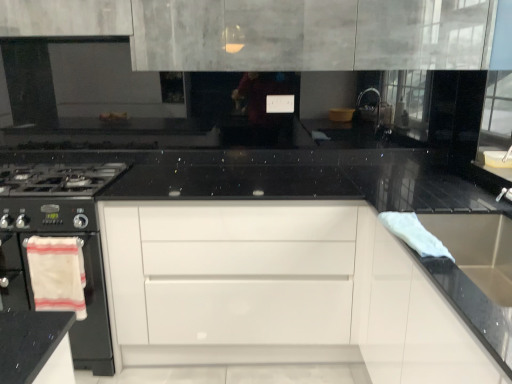
Question: Is white cloth at right, marked as the second material in a bottom-to-top arrangement, inside white glossy drawer at center?

Choices:
 (A) no
 (B) yes

Answer: (A)

Question: From a real-world perspective, is white glossy drawer at center physically above white cloth at right, marked as the second material in a bottom-to-top arrangement?

Choices:
 (A) yes
 (B) no

Answer: (B)

Question: Is white glossy drawer at center further to the viewer compared to white cloth at right, which is the second material from back to front?

Choices:
 (A) no
 (B) yes

Answer: (B)

Question: Can you confirm if white glossy drawer at center is shorter than white cloth at right, the 1th material viewed from the top?

Choices:
 (A) no
 (B) yes

Answer: (A)

Question: From the image's perspective, would you say white glossy drawer at center is shown under white cloth at right, the 1th material when ordered from front to back?

Choices:
 (A) yes
 (B) no

Answer: (A)

Question: Considering the relative sizes of white glossy drawer at center and white cloth at right, the 2th material when ordered from left to right, in the image provided, is white glossy drawer at center smaller than white cloth at right, the 2th material when ordered from left to right,?

Choices:
 (A) no
 (B) yes

Answer: (A)

Question: From the image's perspective, is white cotton towel at left, which is the second material in right-to-left order, beneath white cloth at right, the 1th material when ordered from front to back?

Choices:
 (A) no
 (B) yes

Answer: (B)

Question: Is white cotton towel at left, which is the second material in right-to-left order, aimed at white cloth at right, which is the second material from back to front?

Choices:
 (A) no
 (B) yes

Answer: (A)

Question: Considering the relative sizes of white cotton towel at left, acting as the first material starting from the back, and white cloth at right, which is the second material from back to front, in the image provided, is white cotton towel at left, acting as the first material starting from the back, thinner than white cloth at right, which is the second material from back to front,?

Choices:
 (A) no
 (B) yes

Answer: (B)

Question: Is white cotton towel at left, which is the second material in right-to-left order, not inside white cloth at right, the 1th material from the right?

Choices:
 (A) no
 (B) yes

Answer: (B)

Question: Is white cotton towel at left, acting as the first material starting from the back, closer to camera compared to white cloth at right, marked as the second material in a bottom-to-top arrangement?

Choices:
 (A) no
 (B) yes

Answer: (A)

Question: Can you confirm if white cotton towel at left, positioned as the first material in left-to-right order, is smaller than white glossy drawer at center?

Choices:
 (A) no
 (B) yes

Answer: (B)